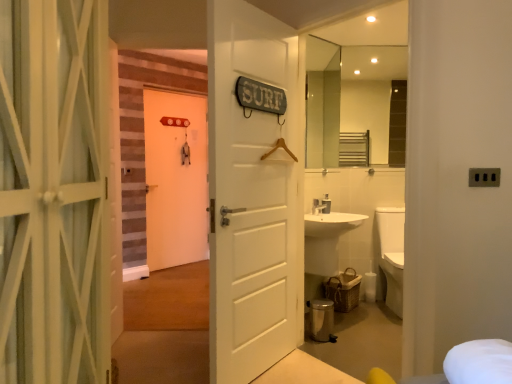
This screenshot has height=384, width=512. Describe the element at coordinates (353, 103) in the screenshot. I see `glossy glass mirror at upper center, which is the 2th mirror in left-to-right order` at that location.

What do you see at coordinates (251, 196) in the screenshot?
I see `white matte door at center, the 2th door from the front` at bounding box center [251, 196].

You are a GUI agent. You are given a task and a screenshot of the screen. Output one action in this format:
    pyautogui.click(x=<x>, y=<y>)
    Task: Click on the white matte door at center, which is the 2th door from back to front
    This screenshot has width=512, height=384.
    Given the screenshot: What is the action you would take?
    click(x=251, y=196)

Identify the location of white painted wood door at left, which is the second door from right to left. This screenshot has width=512, height=384. (53, 191).

What do you see at coordinates (322, 103) in the screenshot?
I see `clear glass mirror at upper right, which appears as the 2th mirror when viewed from the right` at bounding box center [322, 103].

Where is `glossy glass mirror at upper center, which is the 2th mirror in left-to-right order`? This screenshot has height=384, width=512. glossy glass mirror at upper center, which is the 2th mirror in left-to-right order is located at coordinates (353, 103).

Consider the image. Is white matte door at center, the first door when ordered from left to right, taller than clear glass mirror at upper right, which ranks as the 1th mirror in left-to-right order?

Correct, white matte door at center, the first door when ordered from left to right, is much taller as clear glass mirror at upper right, which ranks as the 1th mirror in left-to-right order.

How different are the orientations of white matte door at center, the first door when ordered from left to right, and clear glass mirror at upper right, which ranks as the 1th mirror in left-to-right order, in degrees?

There is a 0.262-degree angle between the facing directions of white matte door at center, the first door when ordered from left to right, and clear glass mirror at upper right, which ranks as the 1th mirror in left-to-right order.

Is white matte door at center, which ranks as the 3th door in front-to-back order, located outside clear glass mirror at upper right, which ranks as the 1th mirror in left-to-right order?

white matte door at center, which ranks as the 3th door in front-to-back order, is positioned outside clear glass mirror at upper right, which ranks as the 1th mirror in left-to-right order.

Which object is further away from the camera, white matte door at center, which is counted as the 1th door, starting from the back, or clear glass mirror at upper right, which appears as the 2th mirror when viewed from the right?

white matte door at center, which is counted as the 1th door, starting from the back, is further from the camera.

Is white matte door at center, the 1th door positioned from the right, further to the viewer compared to clear glass mirror at upper right, which ranks as the 1th mirror in left-to-right order?

That is False.

Is white matte door at center, the 1th door positioned from the right, facing away from clear glass mirror at upper right, which ranks as the 1th mirror in left-to-right order?

white matte door at center, the 1th door positioned from the right, does not have its back to clear glass mirror at upper right, which ranks as the 1th mirror in left-to-right order.

Who is shorter, white matte door at center, the 2th door from the front, or clear glass mirror at upper right, which ranks as the 1th mirror in left-to-right order?

clear glass mirror at upper right, which ranks as the 1th mirror in left-to-right order, is shorter.

Is clear glass mirror at upper right, which ranks as the 1th mirror in left-to-right order, completely or partially inside white matte door at center, which is the 2th door from back to front?

No, clear glass mirror at upper right, which ranks as the 1th mirror in left-to-right order, is located outside of white matte door at center, which is the 2th door from back to front.

From their relative heights in the image, would you say glossy glass mirror at upper center, acting as the 1th mirror starting from the right, is taller or shorter than white painted wood door at left, which is the second door from right to left?

Clearly, glossy glass mirror at upper center, acting as the 1th mirror starting from the right, is shorter compared to white painted wood door at left, which is the second door from right to left.

Is point (390, 54) in front of point (75, 319)?

No.

Would you say glossy glass mirror at upper center, which is the 2th mirror in left-to-right order, is outside white painted wood door at left, the 2th door viewed from the left?

glossy glass mirror at upper center, which is the 2th mirror in left-to-right order, is positioned outside white painted wood door at left, the 2th door viewed from the left.

From the image's perspective, which is below, clear glass mirror at upper right, which ranks as the 1th mirror in left-to-right order, or white painted wood door at left, the 2th door viewed from the left?

From the image's view, white painted wood door at left, the 2th door viewed from the left, is below.

The height and width of the screenshot is (384, 512). I want to click on mirror that is the 1st object above the white painted wood door at left, which is the first door from front to back (from a real-world perspective), so click(x=322, y=103).

How many degrees apart are the facing directions of clear glass mirror at upper right, which ranks as the 1th mirror in left-to-right order, and white painted wood door at left, which is the first door from front to back?

The facing directions of clear glass mirror at upper right, which ranks as the 1th mirror in left-to-right order, and white painted wood door at left, which is the first door from front to back, are 44.6 degrees apart.

Which of these two, clear glass mirror at upper right, which appears as the 2th mirror when viewed from the right, or white painted wood door at left, which is the first door from front to back, stands shorter?

clear glass mirror at upper right, which appears as the 2th mirror when viewed from the right.

Could white matte door at center, which ranks as the 3th door in left-to-right order, be considered to be inside white matte door at center, the first door when ordered from left to right?

No, white matte door at center, the first door when ordered from left to right, does not contain white matte door at center, which ranks as the 3th door in left-to-right order.

Looking at this image, can you confirm if white matte door at center, which ranks as the 3th door in front-to-back order, is bigger than white matte door at center, which is the 2th door from back to front?

Incorrect, white matte door at center, which ranks as the 3th door in front-to-back order, is not larger than white matte door at center, which is the 2th door from back to front.

Is white matte door at center, which ranks as the 3th door in front-to-back order, far away from white matte door at center, the 2th door from the front?

white matte door at center, which ranks as the 3th door in front-to-back order, is far away from white matte door at center, the 2th door from the front.

Does white matte door at center, the first door when ordered from left to right, lie in front of white painted wood door at left, which is the second door from right to left?

No, white matte door at center, the first door when ordered from left to right, is further to the viewer.

Based on their positions, is white matte door at center, which ranks as the 3th door in front-to-back order, located to the left or right of white painted wood door at left, marked as the 3th door in a back-to-front arrangement?

Based on their positions, white matte door at center, which ranks as the 3th door in front-to-back order, is located to the left of white painted wood door at left, marked as the 3th door in a back-to-front arrangement.

From a real-world perspective, between white matte door at center, the first door when ordered from left to right, and white painted wood door at left, the 2th door viewed from the left, who is vertically higher?

white painted wood door at left, the 2th door viewed from the left.

Is white painted wood door at left, marked as the 3th door in a back-to-front arrangement, wider than glossy glass mirror at upper center, which is the 2th mirror in left-to-right order?

Yes.

Which point is more distant from viewer, (3,40) or (324,50)?

The point (324,50) is more distant.

Is white painted wood door at left, which is the first door from front to back, looking in the opposite direction of glossy glass mirror at upper center, which is the 2th mirror in left-to-right order?

white painted wood door at left, which is the first door from front to back, does not have its back to glossy glass mirror at upper center, which is the 2th mirror in left-to-right order.

Which of these two, white painted wood door at left, marked as the 3th door in a back-to-front arrangement, or glossy glass mirror at upper center, which is the 2th mirror in left-to-right order, stands shorter?

Standing shorter between the two is glossy glass mirror at upper center, which is the 2th mirror in left-to-right order.

Find the location of a particular element. Image resolution: width=512 pixels, height=384 pixels. mirror that is the 1st one when counting upward from the white matte door at center, the first door when ordered from left to right (from the image's perspective) is located at coordinates (322, 103).

The image size is (512, 384). I want to click on door that is the 1st one when counting forward from the clear glass mirror at upper right, which ranks as the 1th mirror in left-to-right order, so click(251, 196).

Which object lies nearer to the anchor point white matte door at center, placed as the 3th door when sorted from right to left, white painted wood door at left, which is the first door from front to back, or glossy glass mirror at upper center, which is the 2th mirror in left-to-right order?

glossy glass mirror at upper center, which is the 2th mirror in left-to-right order, is positioned closer to the anchor white matte door at center, placed as the 3th door when sorted from right to left.

From the picture: Based on their spatial positions, is white painted wood door at left, which is the first door from front to back, or white matte door at center, which is the 2th door from back to front, closer to white matte door at center, the first door when ordered from left to right?

white matte door at center, which is the 2th door from back to front, lies closer to white matte door at center, the first door when ordered from left to right, than the other object.

When comparing their distances from glossy glass mirror at upper center, acting as the 1th mirror starting from the right, does white matte door at center, the 1th door positioned from the right, or clear glass mirror at upper right, which appears as the 2th mirror when viewed from the right, seem further?

white matte door at center, the 1th door positioned from the right, lies further to glossy glass mirror at upper center, acting as the 1th mirror starting from the right, than the other object.

From the image, which object appears to be farther from clear glass mirror at upper right, which appears as the 2th mirror when viewed from the right, glossy glass mirror at upper center, acting as the 1th mirror starting from the right, or white painted wood door at left, which is the first door from front to back?

white painted wood door at left, which is the first door from front to back.

Based on their spatial positions, is white matte door at center, placed as the 3th door when sorted from right to left, or glossy glass mirror at upper center, which is the 2th mirror in left-to-right order, closer to white painted wood door at left, which is the first door from front to back?

The object closer to white painted wood door at left, which is the first door from front to back, is glossy glass mirror at upper center, which is the 2th mirror in left-to-right order.

From the image, which object appears to be nearer to white matte door at center, which ranks as the 3th door in front-to-back order, white matte door at center, the 1th door positioned from the right, or white painted wood door at left, which is the second door from right to left?

white matte door at center, the 1th door positioned from the right, is closer to white matte door at center, which ranks as the 3th door in front-to-back order.

Estimate the real-world distances between objects in this image. Which object is closer to clear glass mirror at upper right, which ranks as the 1th mirror in left-to-right order, white matte door at center, the first door when ordered from left to right, or white matte door at center, the 2th door from the front?

white matte door at center, the first door when ordered from left to right.

From the image, which object appears to be nearer to glossy glass mirror at upper center, which is the 2th mirror in left-to-right order, white matte door at center, the first door when ordered from left to right, or white painted wood door at left, which is the first door from front to back?

Based on the image, white matte door at center, the first door when ordered from left to right, appears to be nearer to glossy glass mirror at upper center, which is the 2th mirror in left-to-right order.

Locate an element on the screen. door positioned between white painted wood door at left, which is the second door from right to left, and glossy glass mirror at upper center, which is the 2th mirror in left-to-right order, from near to far is located at coordinates (251, 196).

I want to click on mirror positioned between white matte door at center, which ranks as the 3th door in left-to-right order, and glossy glass mirror at upper center, acting as the 1th mirror starting from the right, from near to far, so click(x=322, y=103).

Locate an element on the screen. The height and width of the screenshot is (384, 512). mirror between white matte door at center, the first door when ordered from left to right, and glossy glass mirror at upper center, which is the 2th mirror in left-to-right order is located at coordinates (322, 103).

Where is `mirror positioned between white painted wood door at left, the 2th door viewed from the left, and glossy glass mirror at upper center, which is the 2th mirror in left-to-right order, from near to far`? mirror positioned between white painted wood door at left, the 2th door viewed from the left, and glossy glass mirror at upper center, which is the 2th mirror in left-to-right order, from near to far is located at coordinates (322, 103).